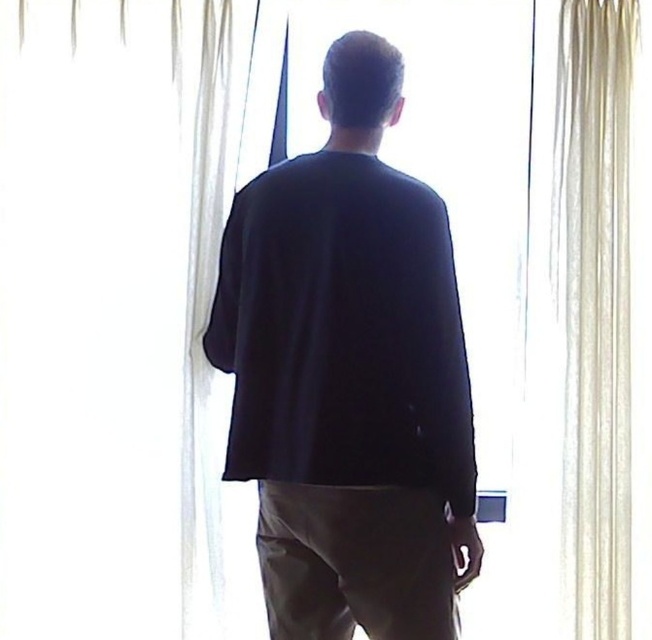
You are a photographer setting up a shoot in this room. You want to ensure that the black matte shirt at center is fully visible in the frame without being obscured by the white sheer curtain at center. Based on the scene description, is this possible? Explain why or why not.

The white sheer curtain at center is much taller than the black matte shirt at center. Since the curtain is taller, it could potentially hang lower and obscure part of the shirt if positioned directly in front. However, since both are at the center and the person is standing between the curtain and the photographer, the shirt would be in front of the curtain. Therefore, the black matte shirt at center will remain fully visible without obstruction from the white sheer curtain at center.